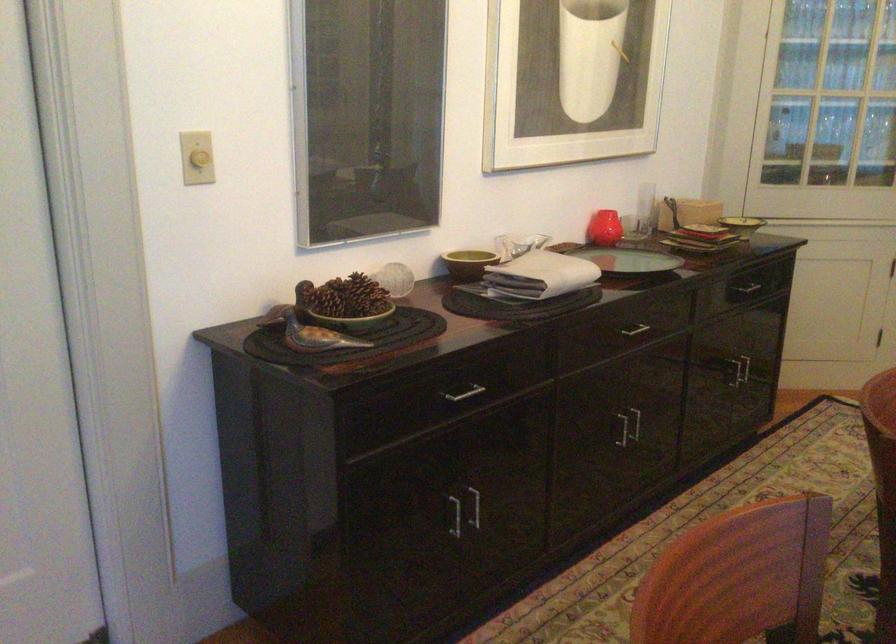
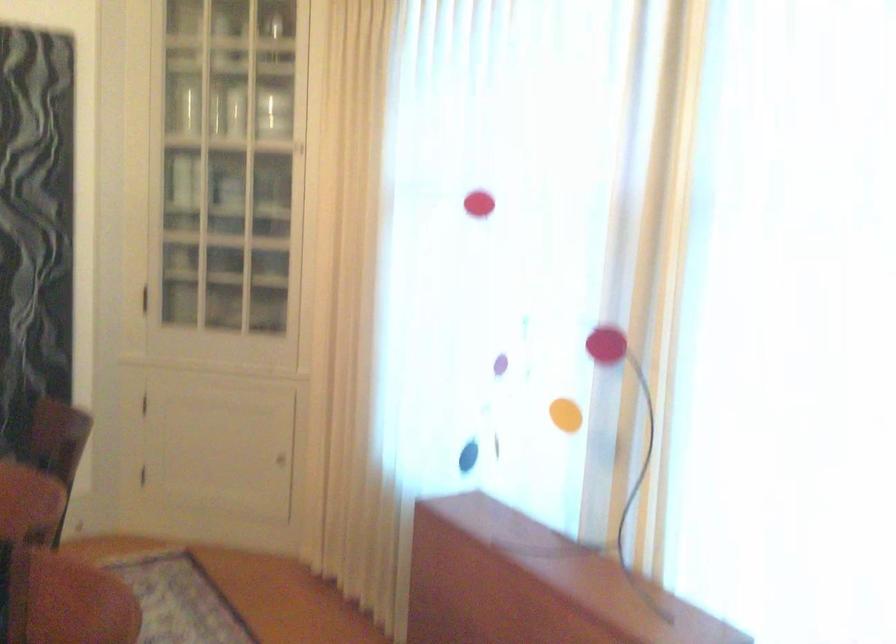
Question: The images are taken continuously from a first-person perspective. In which direction is your viewpoint rotating?

Choices:
 (A) Left
 (B) Right
 (C) Up
 (D) Down

Answer: (B)